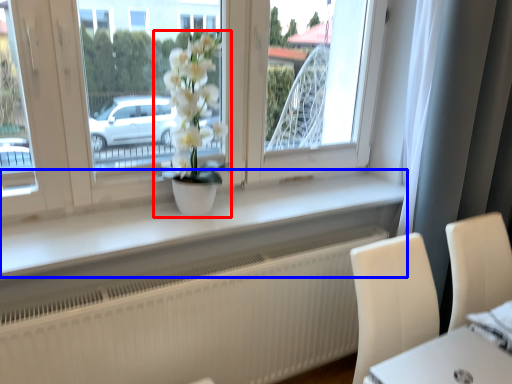
Question: Which of the following is the farthest to the observer, houseplant (highlighted by a red box) or window sill (highlighted by a blue box)?

Choices:
 (A) houseplant
 (B) window sill

Answer: (A)